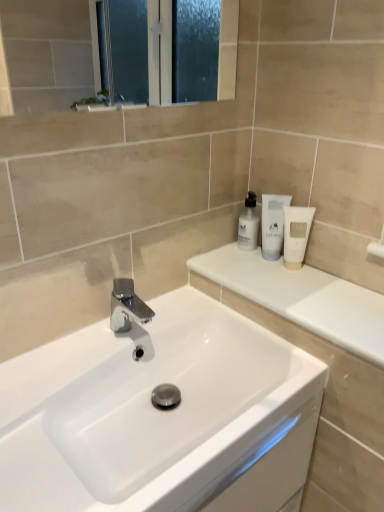
Describe the element at coordinates (248, 224) in the screenshot. The height and width of the screenshot is (512, 384). I see `white glossy lotion at upper right, which ranks as the 1th toiletry in left-to-right order` at that location.

Where is `white glossy sink at center`? white glossy sink at center is located at coordinates (160, 415).

What is the approximate height of white matte tube at upper right, the third toiletry viewed from the left?

The height of white matte tube at upper right, the third toiletry viewed from the left, is 6.72 inches.

Consider the image. What is the approximate width of white glossy countertop at upper right?

24.79 centimeters.

Describe the element at coordinates (127, 307) in the screenshot. I see `polished chrome tap at center` at that location.

Where is `white glossy lotion at upper right, positioned as the third toiletry in right-to-left order`? white glossy lotion at upper right, positioned as the third toiletry in right-to-left order is located at coordinates (248, 224).

Would you say white glossy countertop at upper right contains white matte tube at upper right, the third toiletry viewed from the left?

No, white matte tube at upper right, the third toiletry viewed from the left, is located outside of white glossy countertop at upper right.

Can you tell me how much white glossy countertop at upper right and white matte tube at upper right, the third toiletry viewed from the left, differ in facing direction?

The angular difference between white glossy countertop at upper right and white matte tube at upper right, the third toiletry viewed from the left, is 37.1 degrees.

Considering the positions of objects white glossy countertop at upper right and white matte tube at upper right, the third toiletry viewed from the left, in the image provided, who is in front, white glossy countertop at upper right or white matte tube at upper right, the third toiletry viewed from the left,?

white glossy countertop at upper right is closer to the camera.

Between white glossy countertop at upper right and white matte tube at upper right, the third toiletry viewed from the left, which one has smaller size?

white matte tube at upper right, the third toiletry viewed from the left, is smaller.

Is white glossy sink at center positioned far away from white glossy lotion at upper right, arranged as the 2th toiletry when viewed from the left?

No, white glossy sink at center is in close proximity to white glossy lotion at upper right, arranged as the 2th toiletry when viewed from the left.

Is white glossy sink at center located outside white glossy lotion at upper right, arranged as the 2th toiletry when viewed from the left?

white glossy sink at center lies outside white glossy lotion at upper right, arranged as the 2th toiletry when viewed from the left,'s area.

Who is taller, white glossy sink at center or white glossy lotion at upper right, arranged as the 2th toiletry when viewed from the left?

Standing taller between the two is white glossy lotion at upper right, arranged as the 2th toiletry when viewed from the left.

Is white glossy lotion at upper right, arranged as the 2th toiletry when viewed from the left, further to the viewer compared to polished chrome tap at center?

Yes, it is behind polished chrome tap at center.

Is polished chrome tap at center a part of white glossy lotion at upper right, which is the 2th toiletry in right-to-left order?

No, white glossy lotion at upper right, which is the 2th toiletry in right-to-left order, does not contain polished chrome tap at center.

Which object is positioned more to the left, white glossy lotion at upper right, arranged as the 2th toiletry when viewed from the left, or polished chrome tap at center?

polished chrome tap at center.

Is white glossy lotion at upper right, which is the 2th toiletry in right-to-left order, directly adjacent to polished chrome tap at center?

No, white glossy lotion at upper right, which is the 2th toiletry in right-to-left order, is not with polished chrome tap at center.

Is polished chrome tap at center further to camera compared to white glossy countertop at upper right?

Yes, it is.

Is polished chrome tap at center positioned with its back to white glossy countertop at upper right?

polished chrome tap at center does not have its back to white glossy countertop at upper right.

From the image's perspective, is polished chrome tap at center above or below white glossy countertop at upper right?

Based on their image positions, polished chrome tap at center is located beneath white glossy countertop at upper right.

Can we say polished chrome tap at center lies outside white glossy countertop at upper right?

polished chrome tap at center lies outside white glossy countertop at upper right's area.

Does white glossy lotion at upper right, which ranks as the 1th toiletry in left-to-right order, contain white matte tube at upper right, the third toiletry viewed from the left?

No, white glossy lotion at upper right, which ranks as the 1th toiletry in left-to-right order, does not contain white matte tube at upper right, the third toiletry viewed from the left.

Which is behind, white glossy lotion at upper right, positioned as the third toiletry in right-to-left order, or white matte tube at upper right, placed as the first toiletry when sorted from right to left?

white glossy lotion at upper right, positioned as the third toiletry in right-to-left order, is further away from the camera.

From the image's perspective, which toiletry is the 2nd one above the white matte tube at upper right, placed as the first toiletry when sorted from right to left? Please provide its 2D coordinates.

[(248, 224)]

Which is more to the right, white glossy lotion at upper right, positioned as the third toiletry in right-to-left order, or white matte tube at upper right, placed as the first toiletry when sorted from right to left?

white matte tube at upper right, placed as the first toiletry when sorted from right to left, is more to the right.

From a real-world perspective, is white glossy lotion at upper right, positioned as the third toiletry in right-to-left order, on top of white glossy sink at center?

Correct, in the physical world, white glossy lotion at upper right, positioned as the third toiletry in right-to-left order, is higher than white glossy sink at center.

How different are the orientations of white glossy lotion at upper right, positioned as the third toiletry in right-to-left order, and white glossy sink at center in degrees?

The angle between the facing direction of white glossy lotion at upper right, positioned as the third toiletry in right-to-left order, and the facing direction of white glossy sink at center is 89.7 degrees.

Which is correct: white glossy lotion at upper right, positioned as the third toiletry in right-to-left order, is inside white glossy sink at center, or outside of it?

white glossy lotion at upper right, positioned as the third toiletry in right-to-left order, is not inside white glossy sink at center, it's outside.

Is point (255, 237) farther from viewer compared to point (301, 473)?

Yes, it is behind point (301, 473).

What's the angular difference between white glossy countertop at upper right and polished chrome tap at center's facing directions?

The angular difference between white glossy countertop at upper right and polished chrome tap at center is 92.3 degrees.

Which is behind, point (353, 285) or point (114, 308)?

The point (353, 285) is behind.

From a real-world perspective, which is physically above, white glossy countertop at upper right or polished chrome tap at center?

white glossy countertop at upper right, from a real-world perspective.

Is white glossy countertop at upper right looking in the opposite direction of polished chrome tap at center?

No.

You are a GUI agent. You are given a task and a screenshot of the screen. Output one action in this format:
    pyautogui.click(x=<x>, y=<y>)
    Task: Click on the toiletry that is the 2nd one above the white glossy countertop at upper right (from a real-world perspective)
    Image resolution: width=384 pixels, height=512 pixels.
    Given the screenshot: What is the action you would take?
    pyautogui.click(x=296, y=234)

You are a GUI agent. You are given a task and a screenshot of the screen. Output one action in this format:
    pyautogui.click(x=<x>, y=<y>)
    Task: Click on the 2nd toiletry to the right when counting from the white glossy sink at center
    
    Given the screenshot: What is the action you would take?
    tap(273, 224)

Looking at the image, which one is located closer to polished chrome tap at center, white matte tube at upper right, the third toiletry viewed from the left, or white glossy countertop at upper right?

white glossy countertop at upper right is positioned closer to the anchor polished chrome tap at center.

Considering their positions, is white glossy sink at center positioned further to white glossy lotion at upper right, which is the 2th toiletry in right-to-left order, than white matte tube at upper right, the third toiletry viewed from the left?

Based on the image, white glossy sink at center appears to be further to white glossy lotion at upper right, which is the 2th toiletry in right-to-left order.

When comparing their distances from white glossy lotion at upper right, which is the 2th toiletry in right-to-left order, does white matte tube at upper right, placed as the first toiletry when sorted from right to left, or white glossy sink at center seem further?

white glossy sink at center lies further to white glossy lotion at upper right, which is the 2th toiletry in right-to-left order, than the other object.

From the image, which object appears to be farther from white matte tube at upper right, the third toiletry viewed from the left, white glossy sink at center or white glossy countertop at upper right?

white glossy sink at center.

Based on their spatial positions, is white glossy countertop at upper right or white matte tube at upper right, the third toiletry viewed from the left, closer to polished chrome tap at center?

white glossy countertop at upper right lies closer to polished chrome tap at center than the other object.

Estimate the real-world distances between objects in this image. Which object is closer to white glossy lotion at upper right, arranged as the 2th toiletry when viewed from the left, polished chrome tap at center or white glossy countertop at upper right?

white glossy countertop at upper right is positioned closer to the anchor white glossy lotion at upper right, arranged as the 2th toiletry when viewed from the left.

When comparing their distances from white glossy lotion at upper right, arranged as the 2th toiletry when viewed from the left, does white glossy countertop at upper right or white matte tube at upper right, placed as the first toiletry when sorted from right to left, seem closer?

Among the two, white matte tube at upper right, placed as the first toiletry when sorted from right to left, is located nearer to white glossy lotion at upper right, arranged as the 2th toiletry when viewed from the left.

From the image, which object appears to be nearer to white matte tube at upper right, placed as the first toiletry when sorted from right to left, white glossy lotion at upper right, which is the 2th toiletry in right-to-left order, or polished chrome tap at center?

Among the two, white glossy lotion at upper right, which is the 2th toiletry in right-to-left order, is located nearer to white matte tube at upper right, placed as the first toiletry when sorted from right to left.

This screenshot has height=512, width=384. What are the coordinates of `tap between white glossy sink at center and white glossy lotion at upper right, positioned as the third toiletry in right-to-left order, from front to back` in the screenshot? It's located at (127, 307).

Find the location of a particular element. counter top between polished chrome tap at center and white matte tube at upper right, the third toiletry viewed from the left is located at coordinates (301, 297).

Where is `counter top between white glossy sink at center and white glossy lotion at upper right, which is the 2th toiletry in right-to-left order, along the z-axis`? The image size is (384, 512). counter top between white glossy sink at center and white glossy lotion at upper right, which is the 2th toiletry in right-to-left order, along the z-axis is located at coordinates (301, 297).

I want to click on toiletry between white glossy sink at center and white glossy lotion at upper right, which is the 2th toiletry in right-to-left order, along the z-axis, so click(296, 234).